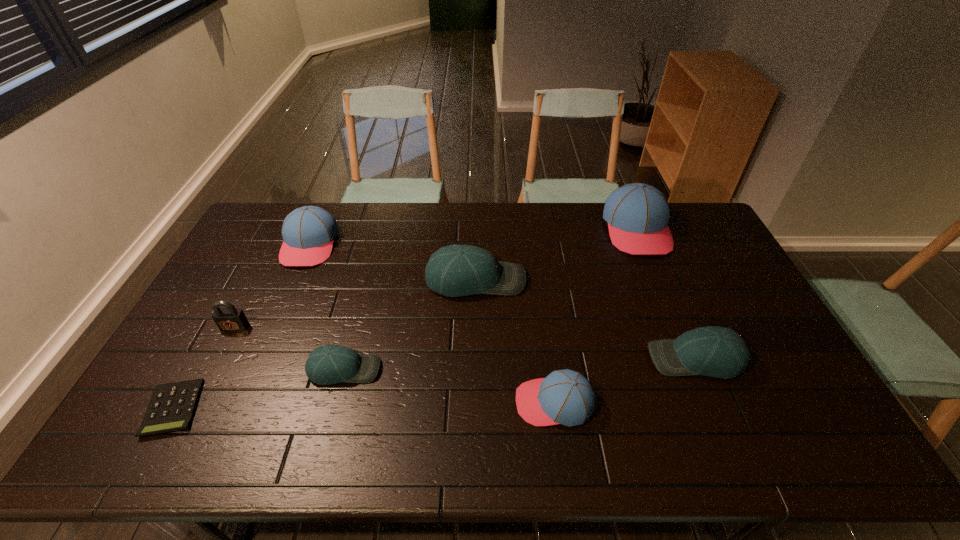
The height and width of the screenshot is (540, 960). I want to click on object located in the near left corner section of the desktop, so click(172, 406).

Identify the location of object located in the far right corner section of the desktop. The image size is (960, 540). (638, 214).

At what (x,y) coordinates should I click in order to perform the action: click on free space at the far edge of the desktop. Please return your answer as a coordinate pair (x, y). The height and width of the screenshot is (540, 960). Looking at the image, I should click on (575, 214).

At what (x,y) coordinates should I click in order to perform the action: click on vacant area at the near edge of the desktop. Please return your answer as a coordinate pair (x, y). The width and height of the screenshot is (960, 540). Looking at the image, I should click on (439, 461).

Find the location of a particular element. This screenshot has height=540, width=960. vacant area at the left edge of the desktop is located at coordinates (236, 338).

Find the location of `free space at the right edge of the desktop`. free space at the right edge of the desktop is located at coordinates (762, 349).

In order to click on vacant area at the far right corner in this screenshot , I will do `click(682, 203)`.

Where is `unoccupied position between the padlock and the second light baseball cap from right to left`? This screenshot has height=540, width=960. unoccupied position between the padlock and the second light baseball cap from right to left is located at coordinates (355, 303).

Image resolution: width=960 pixels, height=540 pixels. In order to click on free spot between the nearest blue baseball cap and the calculator in this screenshot , I will do `click(364, 406)`.

Where is `free spot between the calculator and the nearest blue baseball cap`? free spot between the calculator and the nearest blue baseball cap is located at coordinates (364, 406).